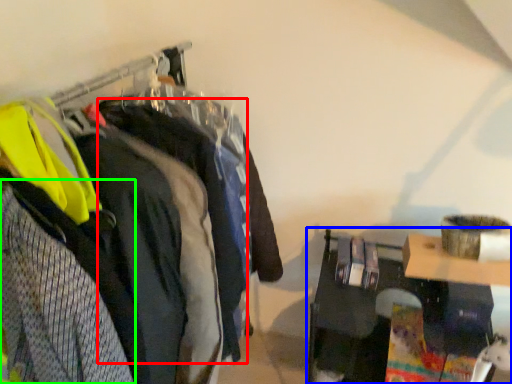
Question: Estimate the real-world distances between objects in this image. Which object is farther from clothing (highlighted by a red box), furniture (highlighted by a blue box) or clothing (highlighted by a green box)?

Choices:
 (A) furniture
 (B) clothing

Answer: (A)